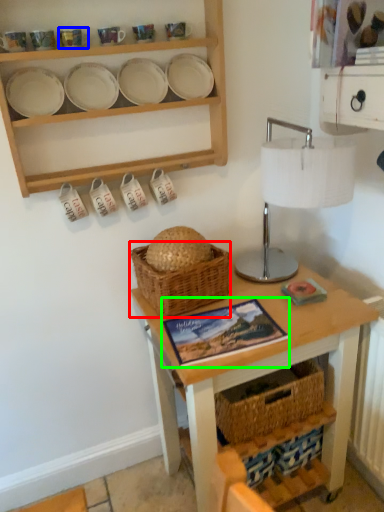
Question: Considering the real-world distances, which object is closest to basket (highlighted by a red box)? tableware (highlighted by a blue box) or book (highlighted by a green box).

Choices:
 (A) tableware
 (B) book

Answer: (B)